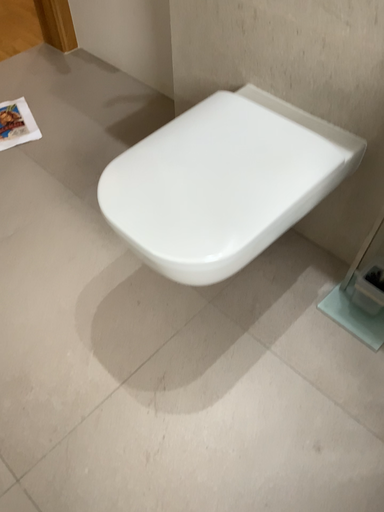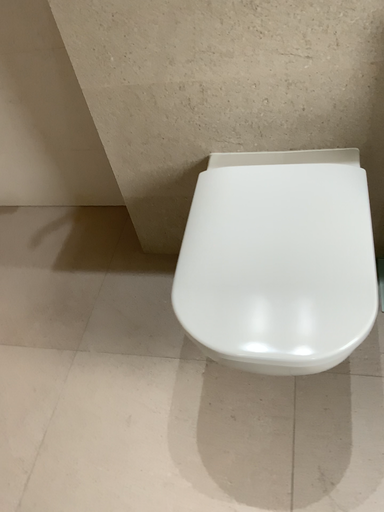
Question: Which way did the camera rotate in the video?

Choices:
 (A) rotated left
 (B) rotated right

Answer: (B)